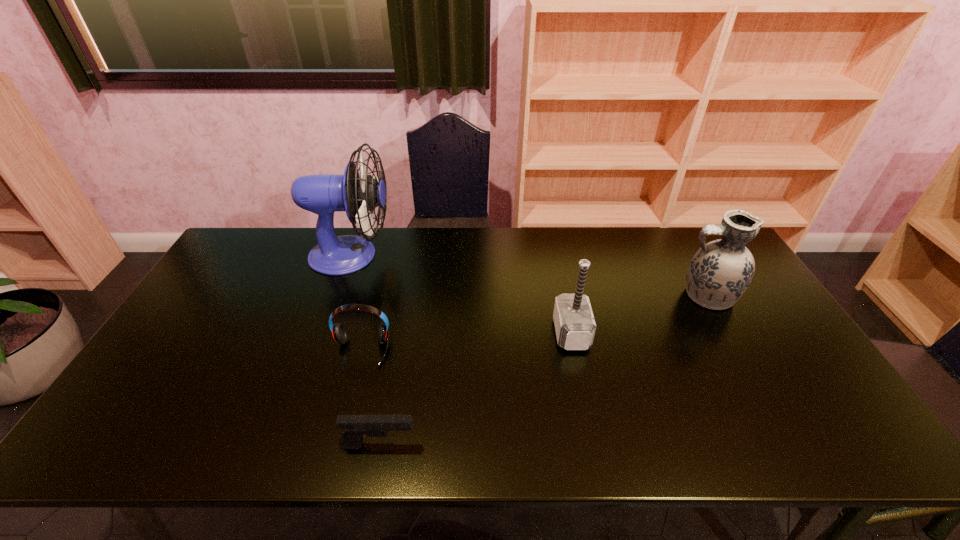
Find the location of a particular element. free space between the nearest object and the vase is located at coordinates (542, 370).

In order to click on free space between the second shortest object and the vase in this screenshot , I will do `click(534, 323)`.

This screenshot has width=960, height=540. I want to click on free space between the nearest object and the fourth tallest object, so click(370, 398).

The height and width of the screenshot is (540, 960). Find the location of `unoccupied area between the second shortest object and the hammer`. unoccupied area between the second shortest object and the hammer is located at coordinates (467, 342).

Where is `object that is the second closest to the hammer`? Image resolution: width=960 pixels, height=540 pixels. object that is the second closest to the hammer is located at coordinates (356, 427).

Point out which object is positioned as the fourth nearest to the fourth object from left to right. Please provide its 2D coordinates. Your answer should be formatted as a tuple, i.e. [(x, y)], where the tuple contains the x and y coordinates of a point satisfying the conditions above.

[(359, 196)]

I want to click on blank space that satisfies the following two spatial constraints: 1. in front of the tallest object where the airflow is directed; 2. with the handle on the side of the vase, so click(337, 296).

Identify the location of free location that satisfies the following two spatial constraints: 1. for striking with the head of the fourth object from left to right; 2. with the microphone attached to the side of the headset. (575, 351).

The image size is (960, 540). I want to click on vacant area that satisfies the following two spatial constraints: 1. for striking with the head of the hammer; 2. with the microphone attached to the side of the fourth tallest object, so click(x=575, y=351).

Locate an element on the screen. The image size is (960, 540). vacant area that satisfies the following two spatial constraints: 1. with the handle on the side of the rightmost object; 2. in front of the tallest object where the airflow is directed is located at coordinates (684, 255).